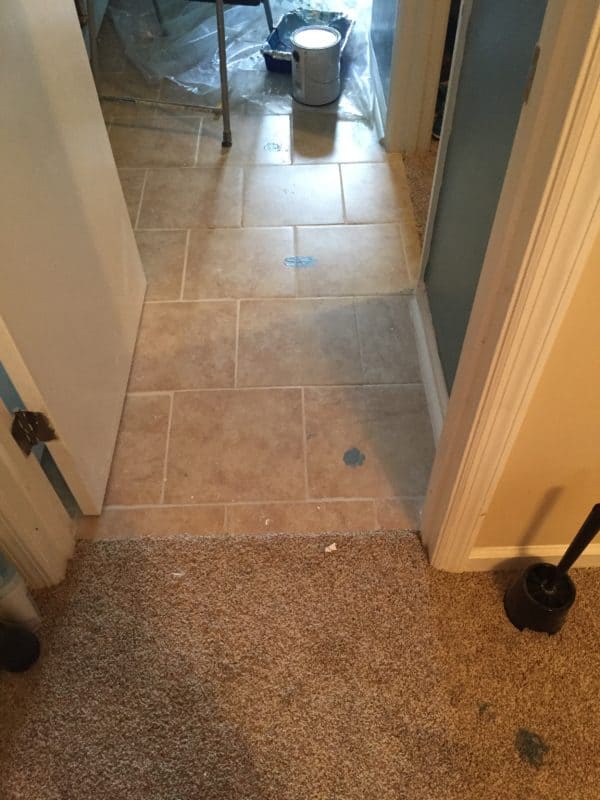
The height and width of the screenshot is (800, 600). What are the coordinates of `brown carpet` in the screenshot? It's located at (371, 672).